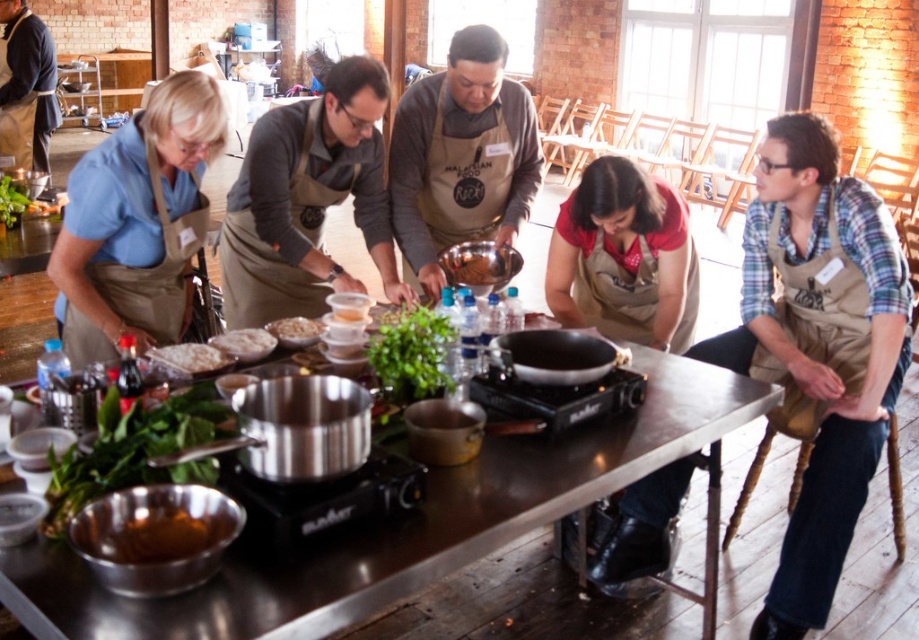
Question: Among these objects, which one is nearest to the camera?

Choices:
 (A) brown matte bowl at center
 (B) dark blue shirt at upper left
 (C) red apron at center

Answer: (C)

Question: Is khaki apron at center to the right of dark blue shirt at upper left from the viewer's perspective?

Choices:
 (A) no
 (B) yes

Answer: (B)

Question: Does metallic stainless steel table at center have a lesser width compared to white fluffy rice at center?

Choices:
 (A) no
 (B) yes

Answer: (A)

Question: Which object is farther from the camera taking this photo?

Choices:
 (A) white flour at center
 (B) white powdery flour at center
 (C) metallic stainless steel table at center
 (D) brown matte bowl at center

Answer: (D)

Question: Which of the following is the farthest from the observer?

Choices:
 (A) braided wood stool at lower right
 (B) dark blue shirt at upper left
 (C) brown matte apron at center

Answer: (B)

Question: Is khaki apron at center to the right of white fluffy rice at center from the viewer's perspective?

Choices:
 (A) yes
 (B) no

Answer: (A)